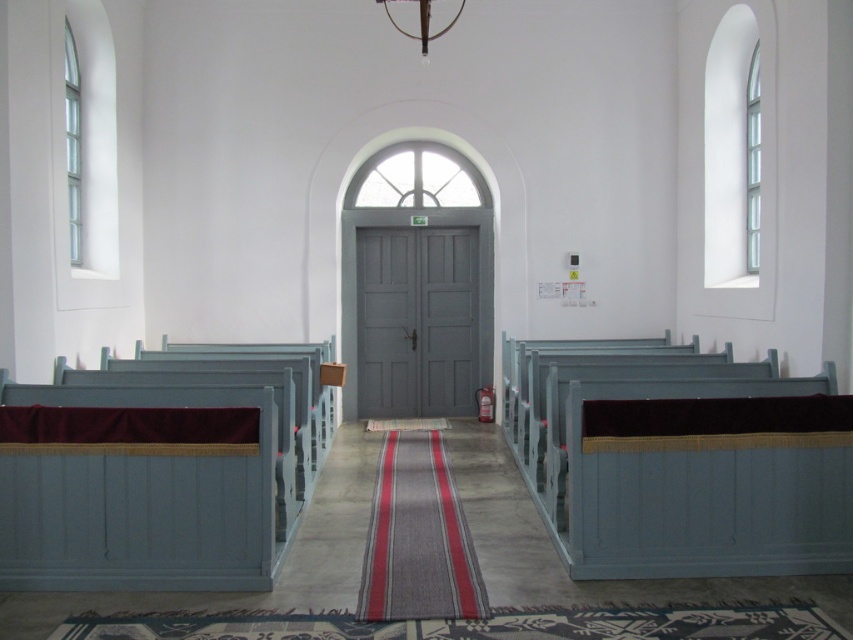
Who is taller, matte blue wood bench at left or matte blue wood church bench at right?

With more height is matte blue wood church bench at right.

Is point (305, 424) farther from viewer compared to point (515, 413)?

No, (305, 424) is in front of (515, 413).

You are a GUI agent. You are given a task and a screenshot of the screen. Output one action in this format:
    pyautogui.click(x=<x>, y=<y>)
    Task: Click on the matte blue wood bench at left
    
    Given the screenshot: What is the action you would take?
    (160, 468)